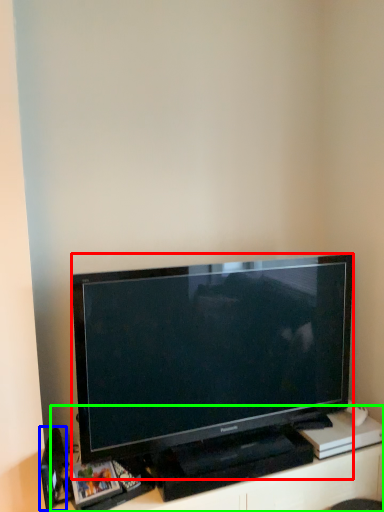
Question: Considering the real-world distances, which object is closest to television (highlighted by a red box)? speaker (highlighted by a blue box) or entertainment center (highlighted by a green box).

Choices:
 (A) speaker
 (B) entertainment center

Answer: (B)